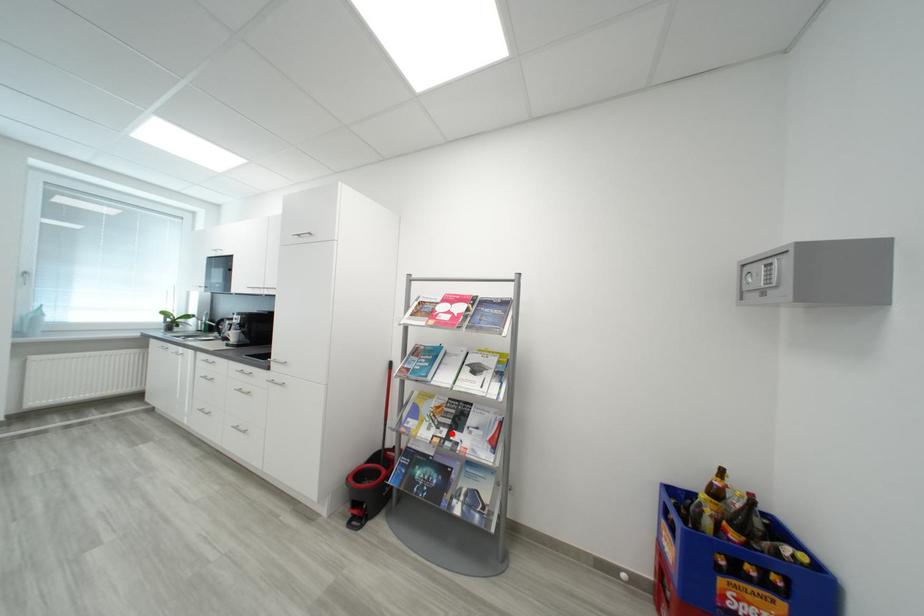
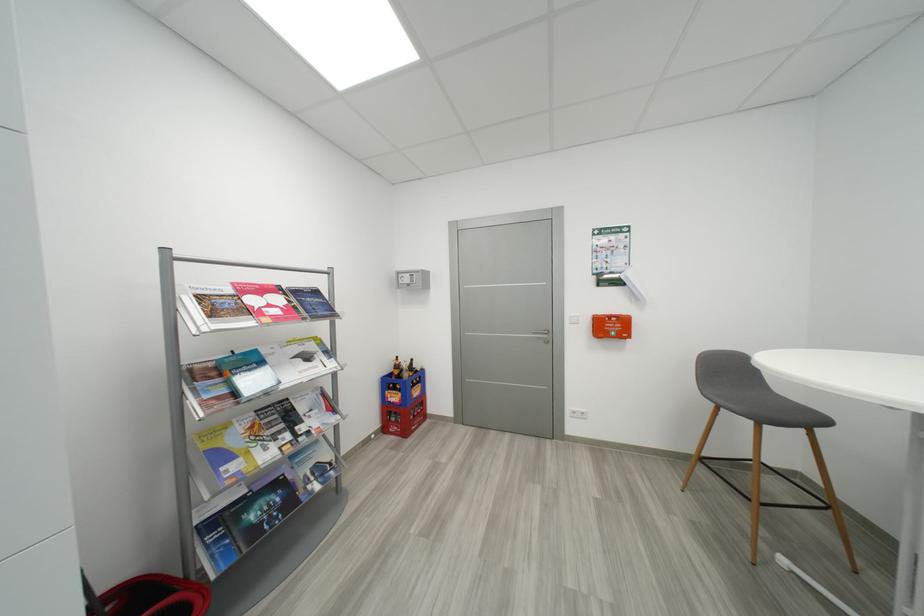
The point at the highlighted location is marked in the first image. Where is the corresponding point in the second image?

(294, 438)